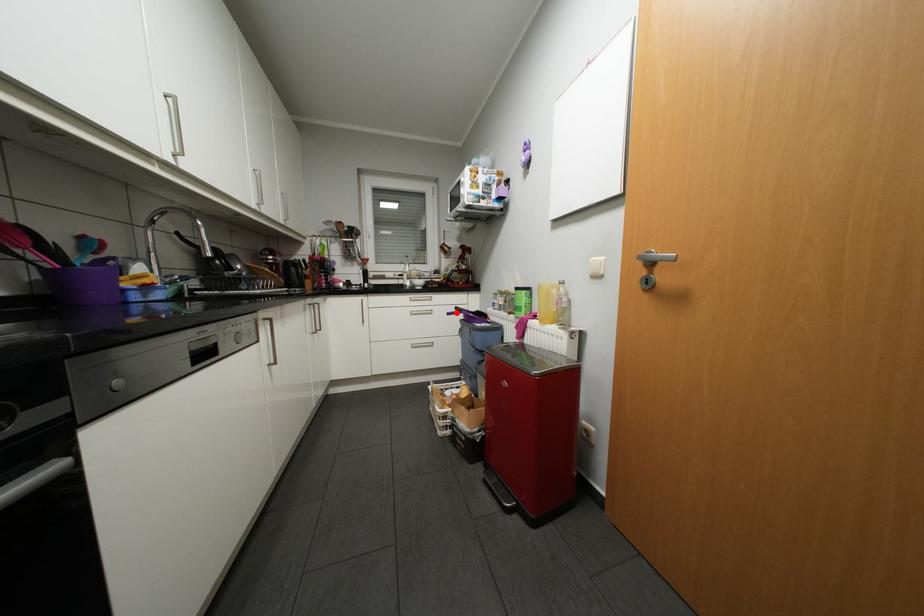
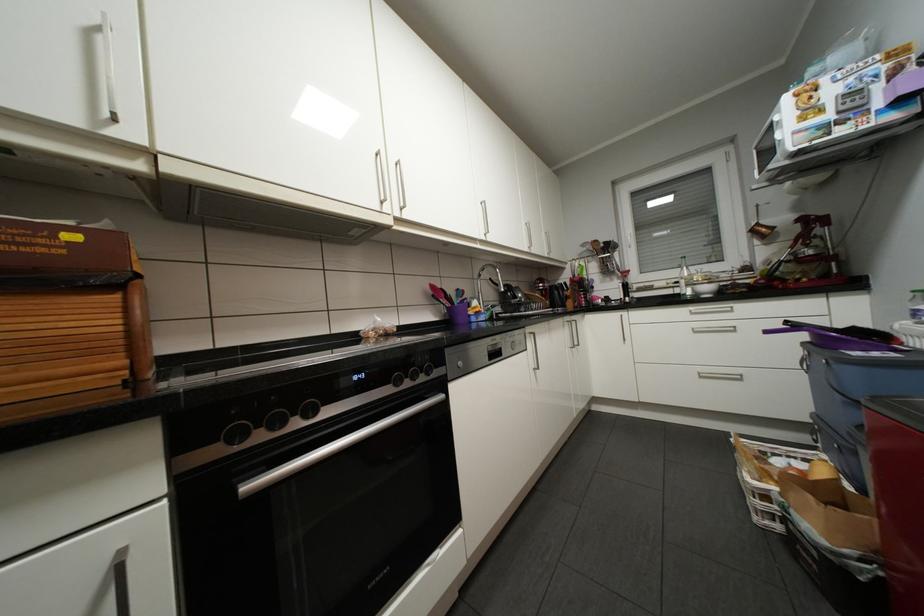
Question: I am providing you with two images of the same scene from different viewpoints. A red point is marked on the first image. Can you still see the location of the red point in image 2?

Choices:
 (A) Yes
 (B) No

Answer: (A)